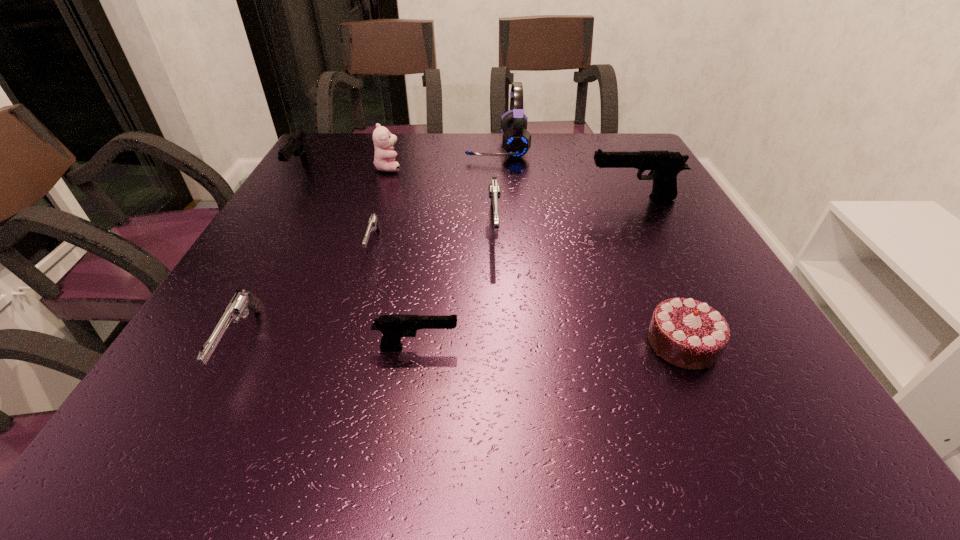
At what (x,y) coordinates should I click in order to perform the action: click on vacant space situated on the front-facing side of the biggest black pistol. Please return your answer as a coordinate pair (x, y). The width and height of the screenshot is (960, 540). Looking at the image, I should click on (473, 198).

This screenshot has width=960, height=540. I want to click on free space located 0.300m at the face of the pink teddy bear, so click(x=512, y=167).

Image resolution: width=960 pixels, height=540 pixels. Find the location of `free space located 0.230m on the front-facing side of the leftmost black pistol`. free space located 0.230m on the front-facing side of the leftmost black pistol is located at coordinates (256, 242).

Image resolution: width=960 pixels, height=540 pixels. What are the coordinates of `vacant space situated on the front-facing side of the biggest silver pistol` in the screenshot? It's located at (503, 435).

You are a GUI agent. You are given a task and a screenshot of the screen. Output one action in this format:
    pyautogui.click(x=<x>, y=<y>)
    Task: Click on the free space located 0.350m on the front-facing side of the second black pistol from left to right
    This screenshot has width=960, height=540.
    Given the screenshot: What is the action you would take?
    pyautogui.click(x=671, y=347)

Where is `free spot located on the left of the chocolate cake`? The height and width of the screenshot is (540, 960). free spot located on the left of the chocolate cake is located at coordinates (617, 343).

Locate an element on the screen. Image resolution: width=960 pixels, height=540 pixels. vacant area situated 0.050m on the front-facing side of the eighth object from right to left is located at coordinates (201, 417).

Where is `vacant region located 0.130m on the front-facing side of the fourth pistol from right to left`? This screenshot has height=540, width=960. vacant region located 0.130m on the front-facing side of the fourth pistol from right to left is located at coordinates point(354,310).

Locate an element on the screen. The width and height of the screenshot is (960, 540). headset located in the far edge section of the desktop is located at coordinates (516, 141).

The image size is (960, 540). Identify the location of teddy bear that is at the far edge. (384, 159).